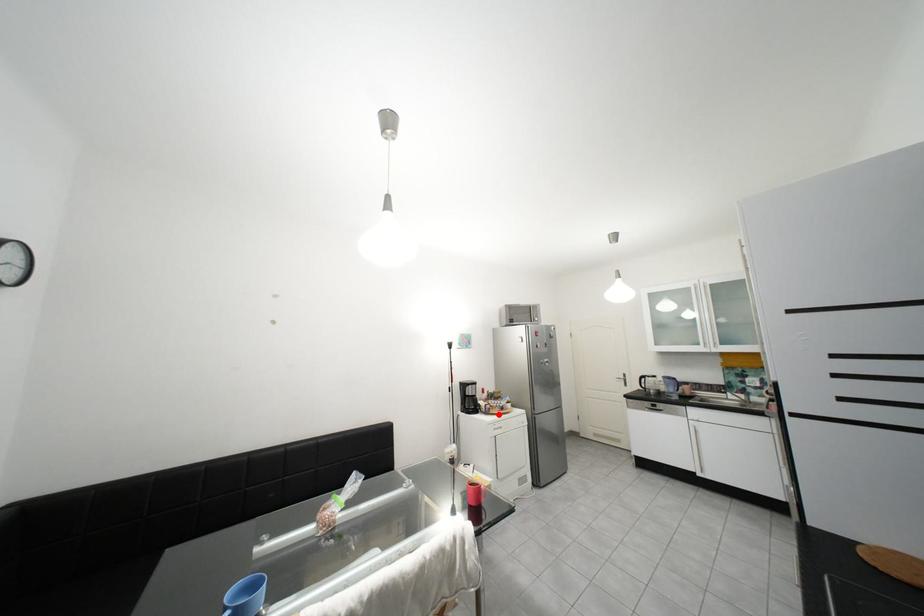
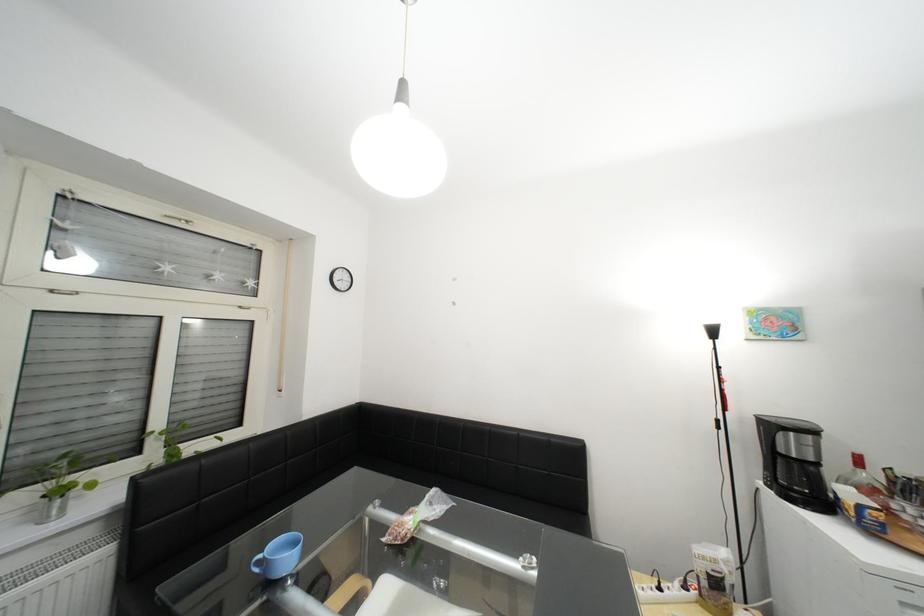
Question: I am providing you with two images of the same scene from different viewpoints. Given a red point in image1, look at the same physical point in image2. Is it:

Choices:
 (A) Closer to the viewpoint
 (B) Farther from the viewpoint

Answer: (A)